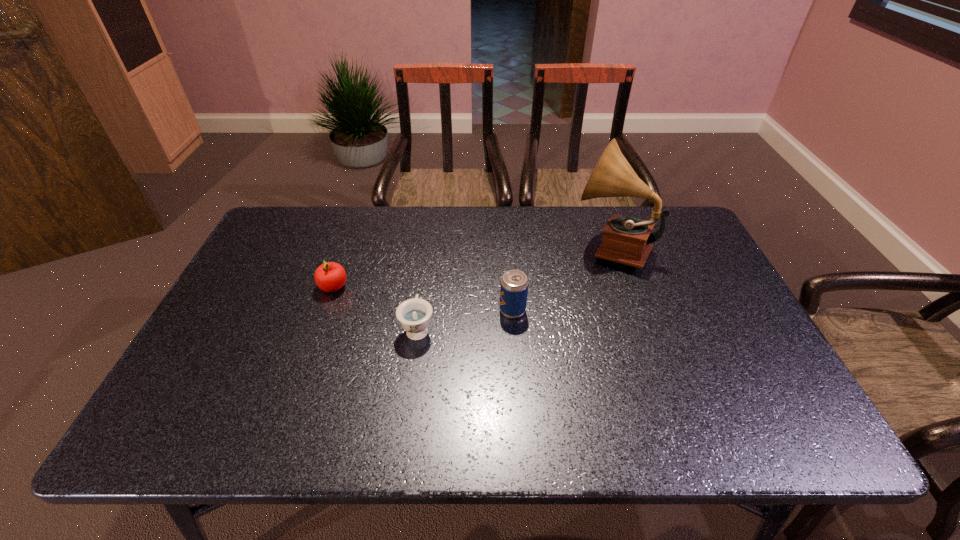
Locate an element on the screen. This screenshot has width=960, height=540. phonograph record is located at coordinates (627, 240).

Where is `the farthest object`? The height and width of the screenshot is (540, 960). the farthest object is located at coordinates (627, 240).

This screenshot has width=960, height=540. I want to click on beer can, so click(514, 284).

Locate an element on the screen. The height and width of the screenshot is (540, 960). the second object from right to left is located at coordinates (514, 284).

The image size is (960, 540). In order to click on apple in this screenshot , I will do `click(330, 277)`.

You are a GUI agent. You are given a task and a screenshot of the screen. Output one action in this format:
    pyautogui.click(x=<x>, y=<y>)
    Task: Click on the third nearest object
    This screenshot has width=960, height=540.
    Given the screenshot: What is the action you would take?
    pyautogui.click(x=330, y=277)

Identify the location of the third object from right to left. (414, 314).

Locate an element on the screen. the shortest object is located at coordinates (414, 314).

Find the location of a particular element. The width and height of the screenshot is (960, 540). vacant space situated 0.120m on the horn of the tallest object is located at coordinates (533, 247).

Find the location of `vacant space located 0.380m on the horn of the tallest object`. vacant space located 0.380m on the horn of the tallest object is located at coordinates (449, 247).